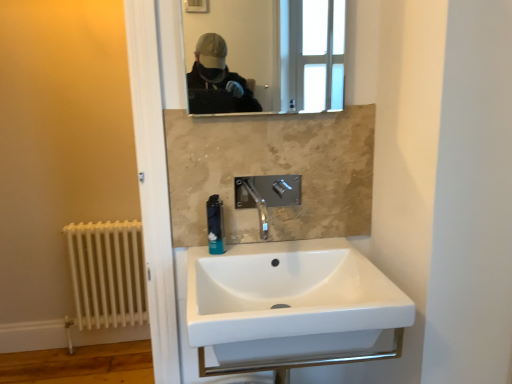
The width and height of the screenshot is (512, 384). Describe the element at coordinates (268, 52) in the screenshot. I see `matte glass mirror at upper center` at that location.

What are the coordinates of `matte glass mirror at upper center` in the screenshot? It's located at (268, 52).

This screenshot has height=384, width=512. Describe the element at coordinates (106, 274) in the screenshot. I see `white painted metal radiator at lower left` at that location.

Locate an element on the screen. This screenshot has width=512, height=384. matte glass mirror at upper center is located at coordinates (268, 52).

From a real-world perspective, is polished chrome faucet at center positioned above or below white ceramic sink at center?

In terms of real-world spatial position, polished chrome faucet at center is above white ceramic sink at center.

In order to click on tap located behind the white ceramic sink at center in this screenshot , I will do `click(267, 195)`.

Would you say polished chrome faucet at center is a long distance from white ceramic sink at center?

polished chrome faucet at center is near white ceramic sink at center, not far away.

Is polished chrome faucet at center inside the boundaries of white ceramic sink at center, or outside?

polished chrome faucet at center is not inside white ceramic sink at center, it's outside.

Which is correct: blue plastic soap dispenser at center is inside white painted metal radiator at lower left, or outside of it?

blue plastic soap dispenser at center is not inside white painted metal radiator at lower left, it's outside.

Consider the image. From the image's perspective, is blue plastic soap dispenser at center positioned above or below white painted metal radiator at lower left?

blue plastic soap dispenser at center is above white painted metal radiator at lower left.

Between blue plastic soap dispenser at center and white painted metal radiator at lower left, which one appears on the right side from the viewer's perspective?

blue plastic soap dispenser at center is more to the right.

Is blue plastic soap dispenser at center taller or shorter than white painted metal radiator at lower left?

blue plastic soap dispenser at center is shorter than white painted metal radiator at lower left.

From the picture: Does polished chrome faucet at center contain white painted metal radiator at lower left?

No, white painted metal radiator at lower left is not surrounded by polished chrome faucet at center.

Is polished chrome faucet at center in front of or behind white painted metal radiator at lower left in the image?

In the image, polished chrome faucet at center appears in front of white painted metal radiator at lower left.

Is polished chrome faucet at center facing away from white painted metal radiator at lower left?

No, white painted metal radiator at lower left is not at the back of polished chrome faucet at center.

Is point (265, 205) closer or farther from the camera than point (89, 295)?

Point (265, 205) is closer to the camera than point (89, 295).

Measure the distance from blue plastic soap dispenser at center to polished chrome faucet at center.

blue plastic soap dispenser at center is 5.76 inches away from polished chrome faucet at center.

Which object is wider, blue plastic soap dispenser at center or polished chrome faucet at center?

polished chrome faucet at center.

How different are the orientations of blue plastic soap dispenser at center and polished chrome faucet at center in degrees?

0.0162 degrees separate the facing orientations of blue plastic soap dispenser at center and polished chrome faucet at center.

Image resolution: width=512 pixels, height=384 pixels. What are the coordinates of `tap in front of the blue plastic soap dispenser at center` in the screenshot? It's located at (267, 195).

Which is correct: white painted metal radiator at lower left is inside polished chrome faucet at center, or outside of it?

white painted metal radiator at lower left is outside polished chrome faucet at center.

Does point (80, 255) come in front of point (239, 188)?

No, it is behind (239, 188).

Find the location of a particular element. This screenshot has width=512, height=384. tap that is in front of the white painted metal radiator at lower left is located at coordinates point(267,195).

In the image, is white painted metal radiator at lower left on the left side or the right side of polished chrome faucet at center?

From the image, it's evident that white painted metal radiator at lower left is to the left of polished chrome faucet at center.

Considering the relative positions of blue plastic soap dispenser at center and matte glass mirror at upper center in the image provided, is blue plastic soap dispenser at center to the left of matte glass mirror at upper center from the viewer's perspective?

Yes.

Consider the image. Is the depth of blue plastic soap dispenser at center less than that of matte glass mirror at upper center?

No, blue plastic soap dispenser at center is behind matte glass mirror at upper center.

Considering the sizes of objects blue plastic soap dispenser at center and matte glass mirror at upper center in the image provided, who is thinner, blue plastic soap dispenser at center or matte glass mirror at upper center?

With smaller width is matte glass mirror at upper center.

Is blue plastic soap dispenser at center not near matte glass mirror at upper center?

Yes.

Is matte glass mirror at upper center situated inside white ceramic sink at center or outside?

matte glass mirror at upper center is outside white ceramic sink at center.

Is matte glass mirror at upper center in front of or behind white ceramic sink at center in the image?

matte glass mirror at upper center is positioned farther from the viewer than white ceramic sink at center.

Is matte glass mirror at upper center turned away from white ceramic sink at center?

That's not correct — matte glass mirror at upper center is not looking away from white ceramic sink at center.

From a real-world perspective, is matte glass mirror at upper center located higher than white ceramic sink at center?

Yes.

Image resolution: width=512 pixels, height=384 pixels. Find the location of `sink that is under the polished chrome faucet at center (from a real-world perspective)`. sink that is under the polished chrome faucet at center (from a real-world perspective) is located at coordinates (291, 307).

At what (x,y) coordinates should I click in order to perform the action: click on radiator on the left of blue plastic soap dispenser at center. Please return your answer as a coordinate pair (x, y). Looking at the image, I should click on (106, 274).

Estimate the real-world distances between objects in this image. Which object is closer to blue plastic soap dispenser at center, white ceramic sink at center or polished chrome faucet at center?

Answer: Based on the image, polished chrome faucet at center appears to be nearer to blue plastic soap dispenser at center.

Estimate the real-world distances between objects in this image. Which object is further from polished chrome faucet at center, blue plastic soap dispenser at center or white painted metal radiator at lower left?

Among the two, white painted metal radiator at lower left is located further to polished chrome faucet at center.

When comparing their distances from polished chrome faucet at center, does white ceramic sink at center or matte glass mirror at upper center seem further?

Based on the image, matte glass mirror at upper center appears to be further to polished chrome faucet at center.

From the image, which object appears to be nearer to white ceramic sink at center, matte glass mirror at upper center or blue plastic soap dispenser at center?

blue plastic soap dispenser at center lies closer to white ceramic sink at center than the other object.

When comparing their distances from blue plastic soap dispenser at center, does polished chrome faucet at center or matte glass mirror at upper center seem closer?

polished chrome faucet at center is closer to blue plastic soap dispenser at center.

Looking at the image, which one is located further to blue plastic soap dispenser at center, matte glass mirror at upper center or polished chrome faucet at center?

matte glass mirror at upper center is further to blue plastic soap dispenser at center.

In the scene shown: From the image, which object appears to be farther from white painted metal radiator at lower left, matte glass mirror at upper center or white ceramic sink at center?

white ceramic sink at center is further to white painted metal radiator at lower left.

When comparing their distances from blue plastic soap dispenser at center, does polished chrome faucet at center or white painted metal radiator at lower left seem closer?

Among the two, polished chrome faucet at center is located nearer to blue plastic soap dispenser at center.

Image resolution: width=512 pixels, height=384 pixels. I want to click on tap between matte glass mirror at upper center and white ceramic sink at center from top to bottom, so click(267, 195).

This screenshot has width=512, height=384. I want to click on mirror between white ceramic sink at center and white painted metal radiator at lower left in the front-back direction, so click(x=268, y=52).

Locate an element on the screen. Image resolution: width=512 pixels, height=384 pixels. soap dispenser between white ceramic sink at center and white painted metal radiator at lower left from front to back is located at coordinates (215, 225).

The height and width of the screenshot is (384, 512). Find the location of `soap dispenser between matte glass mirror at upper center and white painted metal radiator at lower left along the z-axis`. soap dispenser between matte glass mirror at upper center and white painted metal radiator at lower left along the z-axis is located at coordinates (215, 225).